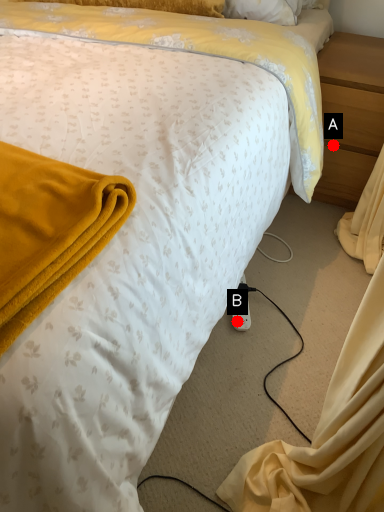
Question: Two points are circled on the image, labeled by A and B beside each circle. Which point is farther from the camera taking this photo?

Choices:
 (A) A is further
 (B) B is further

Answer: (A)